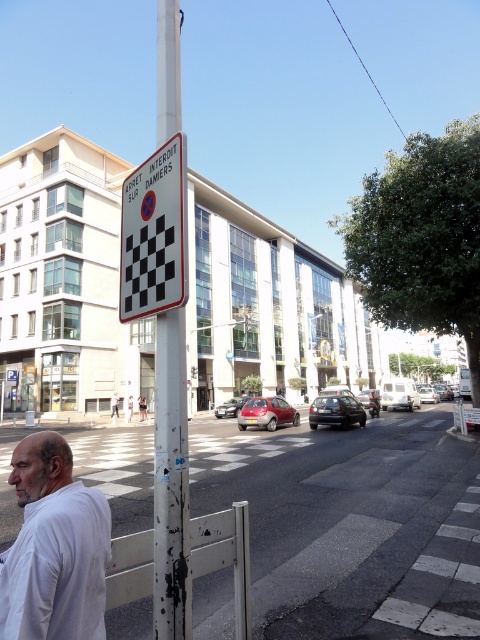
Can you confirm if white painted metal pole at center is smaller than white plastic sign at upper center?

No, white painted metal pole at center is not smaller than white plastic sign at upper center.

Is point (182, 570) farther from camera compared to point (172, 179)?

No, (182, 570) is closer to viewer.

This screenshot has width=480, height=640. What do you see at coordinates (170, 481) in the screenshot?
I see `white painted metal pole at center` at bounding box center [170, 481].

At what (x,y) coordinates should I click in order to perform the action: click on white painted metal pole at center. Please return your answer as a coordinate pair (x, y). This screenshot has width=480, height=640. Looking at the image, I should click on (170, 481).

Does white matte shirt at lower left appear under white painted metal pole at center?

Yes, white matte shirt at lower left is below white painted metal pole at center.

Is point (68, 483) farther from camera compared to point (168, 531)?

No.

Locate an element on the screen. white matte shirt at lower left is located at coordinates (54, 548).

Can you confirm if white matte shirt at lower left is smaller than white plastic sign at upper center?

Yes, white matte shirt at lower left is smaller than white plastic sign at upper center.

The height and width of the screenshot is (640, 480). Find the location of `white matte shirt at lower left`. white matte shirt at lower left is located at coordinates (54, 548).